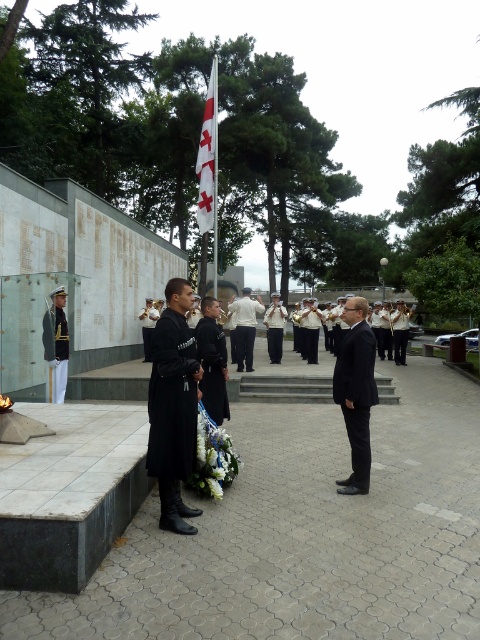
Question: Which object appears farthest from the camera in this image?

Choices:
 (A) gold metallic uniform at left
 (B) black matte coat at left
 (C) black matte uniform at center

Answer: (A)

Question: Can you confirm if black matte coat at left is positioned above white shirt at center?

Choices:
 (A) yes
 (B) no

Answer: (B)

Question: Which point appears closest to the camera in this image?

Choices:
 (A) (283, 310)
 (B) (208, 358)

Answer: (B)

Question: Does gold metallic uniform at left appear over white shirt at center?

Choices:
 (A) no
 (B) yes

Answer: (A)

Question: Among these points, which one is nearest to the camera?

Choices:
 (A) (282, 320)
 (B) (354, 403)
 (C) (181, 332)
 (D) (211, 205)

Answer: (C)

Question: Is white fabric flag at center closer to camera compared to white shirt at center?

Choices:
 (A) no
 (B) yes

Answer: (B)